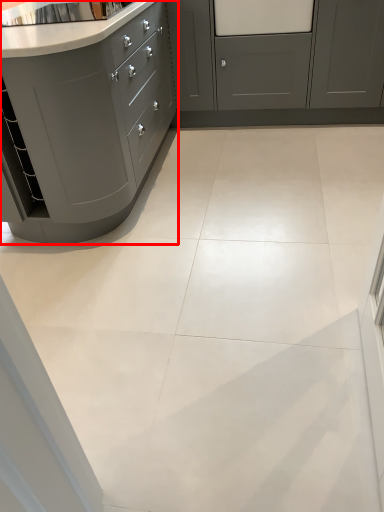
Question: From the image's perspective, what is the correct spatial positioning of cabinetry (annotated by the red box) in reference to cabinetry?

Choices:
 (A) above
 (B) below

Answer: (B)